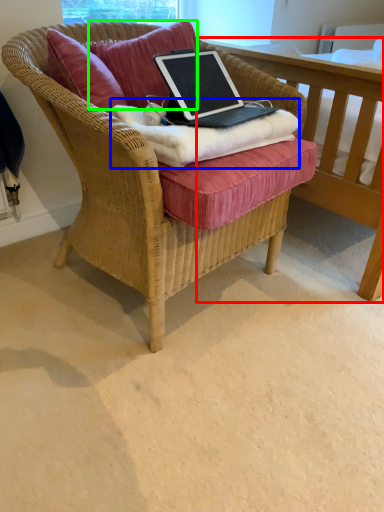
Question: Estimate the real-world distances between objects in this image. Which object is farther from table (highlighted by a red box), blanket (highlighted by a blue box) or pillow (highlighted by a green box)?

Choices:
 (A) blanket
 (B) pillow

Answer: (B)